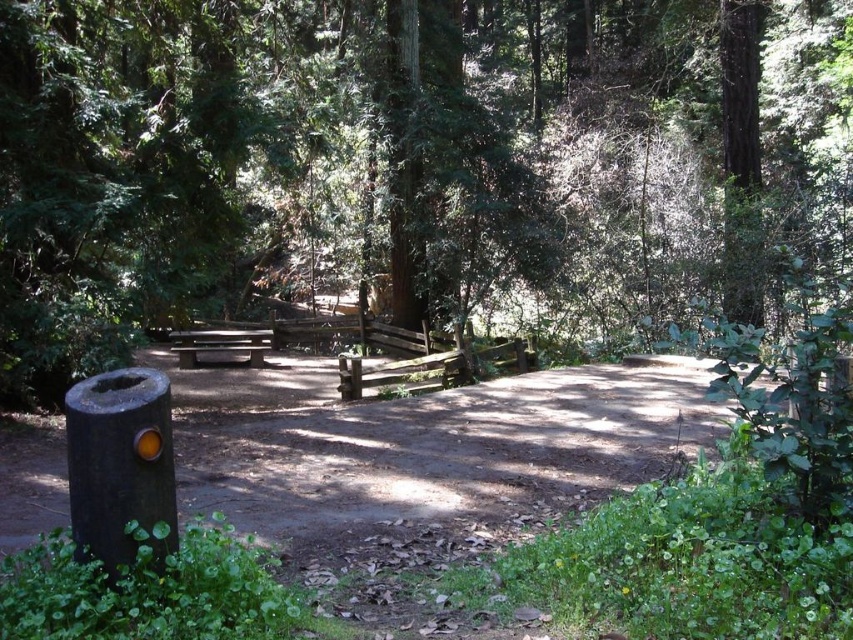
You are a hiker who wants to take a photo of the smooth brown picnic table at center while standing near the black matte post at lower left. Can you see the picnic table clearly from your current position?

The black matte post at lower left is closer to the viewer than the smooth brown picnic table at center, so yes, you can see the picnic table clearly from your current position.